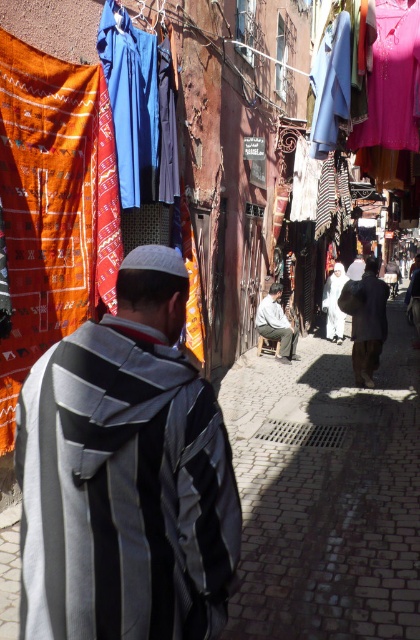
Question: Can you confirm if dark gray fabric bag at center is positioned above light brown leather jacket at center?

Choices:
 (A) yes
 (B) no

Answer: (B)

Question: Does striped woolen shawl at center have a smaller size compared to dark gray fabric bag at center?

Choices:
 (A) no
 (B) yes

Answer: (B)

Question: Does dark gray fabric bag at center appear under light brown leather jacket at center?

Choices:
 (A) no
 (B) yes

Answer: (B)

Question: Considering the real-world distances, which object is farthest from the light brown leather jacket at center?

Choices:
 (A) dark gray fabric bag at center
 (B) striped woolen shawl at center

Answer: (B)

Question: Which point appears farthest from the camera in this image?

Choices:
 (A) (194, 577)
 (B) (270, 332)

Answer: (B)

Question: Which point is farther from the camera taking this photo?

Choices:
 (A) (352, 285)
 (B) (264, 324)

Answer: (B)